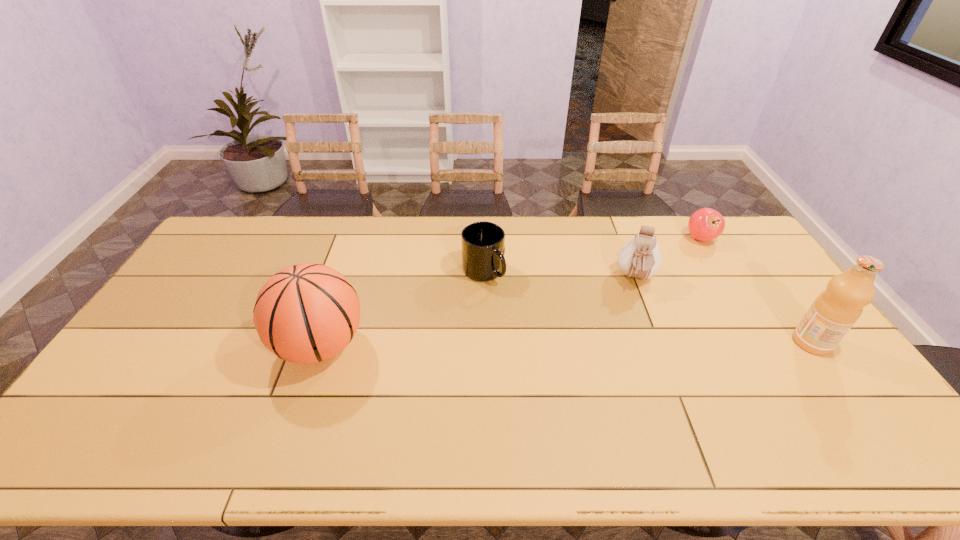
I want to click on free space on the desktop that is between the leftmost object and the rightmost object and is positioned on the front-facing side of the third object from left to right, so click(x=637, y=343).

You are a GUI agent. You are given a task and a screenshot of the screen. Output one action in this format:
    pyautogui.click(x=<x>, y=<y>)
    Task: Click on the vacant space on the desktop that is between the basketball and the rightmost object and is positioned with the handle on the side of the second object from left to right
    The height and width of the screenshot is (540, 960).
    Given the screenshot: What is the action you would take?
    pyautogui.click(x=529, y=344)

What are the coordinates of `vacant space on the desktop that is between the leftmost object and the rightmost object and is positioned on the stem of the shortest object` in the screenshot? It's located at (637, 343).